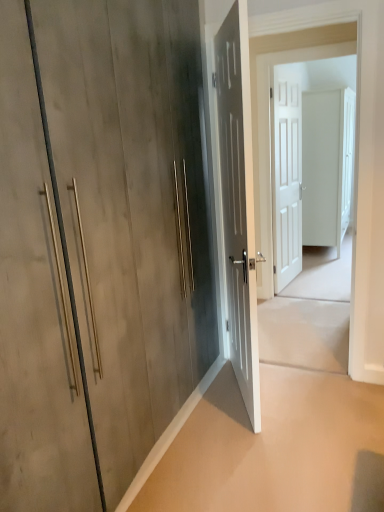
Where is `free spot above white matte door at center (from a real-world perspective)`? This screenshot has height=512, width=384. free spot above white matte door at center (from a real-world perspective) is located at coordinates (304, 41).